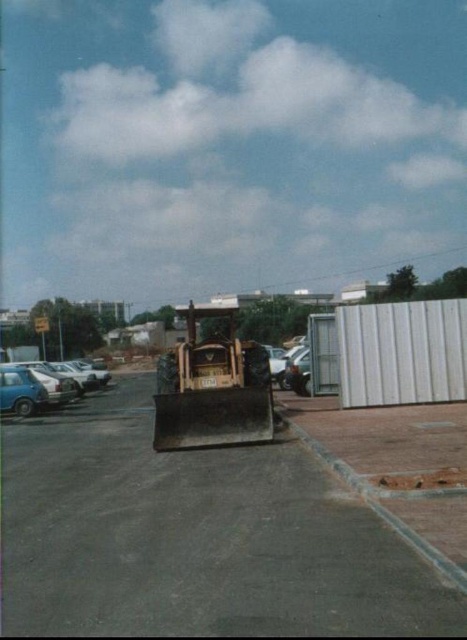
You are a delivery driver who needs to park your truck on the concrete asphalt parking lot at center. However, your truck is 2 meters tall. Can you safely park there without hitting the matte blue car at left that is parked nearby?

The concrete asphalt parking lot at center has a lesser height compared to matte blue car at left, meaning the parking lot is lower than the car. Since your truck is 2 meters tall, you need to ensure there is enough vertical clearance. However, the description does not provide specific height measurements for the parking lot or the car. Therefore, it is unclear if the truck will fit safely. You should check the actual height limits or consult the parking lot guidelines before proceeding.